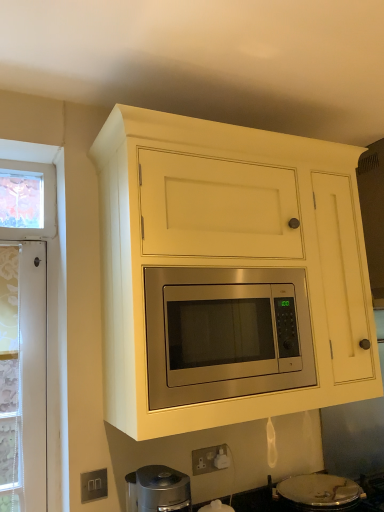
Question: Are stainless steel microwave at center and satin silver outlet at lower left located far from each other?

Choices:
 (A) no
 (B) yes

Answer: (A)

Question: Is stainless steel microwave at center positioned before satin silver outlet at lower left?

Choices:
 (A) yes
 (B) no

Answer: (A)

Question: From the image's perspective, is stainless steel microwave at center located beneath satin silver outlet at lower left?

Choices:
 (A) yes
 (B) no

Answer: (B)

Question: Does stainless steel microwave at center turn towards satin silver outlet at lower left?

Choices:
 (A) yes
 (B) no

Answer: (B)

Question: From the image's perspective, is stainless steel microwave at center over satin silver outlet at lower left?

Choices:
 (A) yes
 (B) no

Answer: (A)

Question: Considering the relative sizes of stainless steel microwave at center and satin silver outlet at lower left in the image provided, is stainless steel microwave at center thinner than satin silver outlet at lower left?

Choices:
 (A) no
 (B) yes

Answer: (A)

Question: Is silver metallic gas stove at lower center inside matte yellow cabinet at center?

Choices:
 (A) no
 (B) yes

Answer: (A)

Question: Is there a large distance between matte yellow cabinet at center and silver metallic gas stove at lower center?

Choices:
 (A) yes
 (B) no

Answer: (B)

Question: Does matte yellow cabinet at center appear on the right side of silver metallic gas stove at lower center?

Choices:
 (A) no
 (B) yes

Answer: (A)

Question: From the image's perspective, is matte yellow cabinet at center on top of silver metallic gas stove at lower center?

Choices:
 (A) yes
 (B) no

Answer: (A)

Question: Is the surface of matte yellow cabinet at center in direct contact with silver metallic gas stove at lower center?

Choices:
 (A) yes
 (B) no

Answer: (B)

Question: Does matte yellow cabinet at center have a smaller size compared to silver metallic gas stove at lower center?

Choices:
 (A) no
 (B) yes

Answer: (A)

Question: Is silver metallic gas stove at lower center beside stainless steel microwave at center?

Choices:
 (A) no
 (B) yes

Answer: (A)